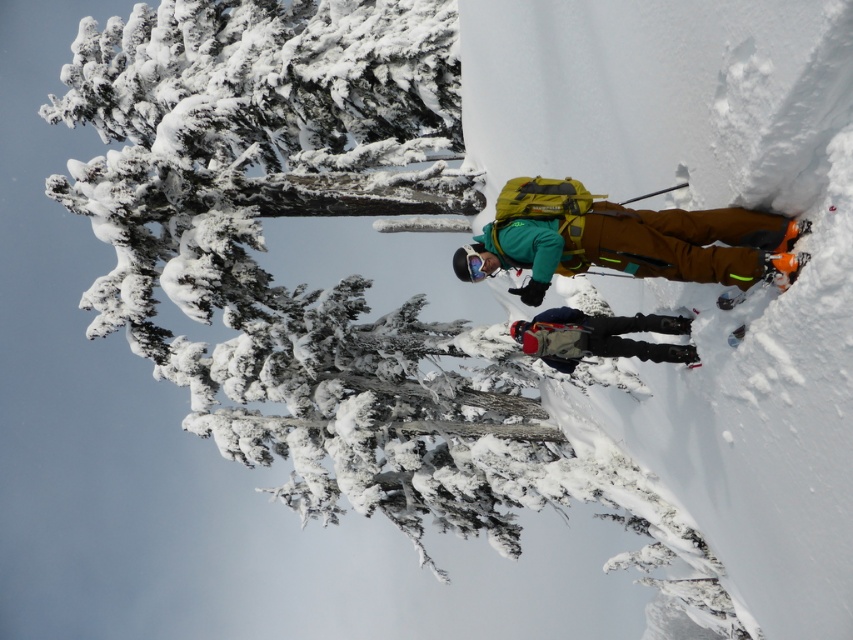
In the scene shown: You are navigating through the snowy forest and need to reach a specific location marked by point coordinates. You are currently at point coordinates point (523, 211). Which direction should you move to reach point coordinates point (120, 227)?

You should move forward because point (120, 227) is behind point (523, 211), meaning it is in the direction you are facing as you move forward.